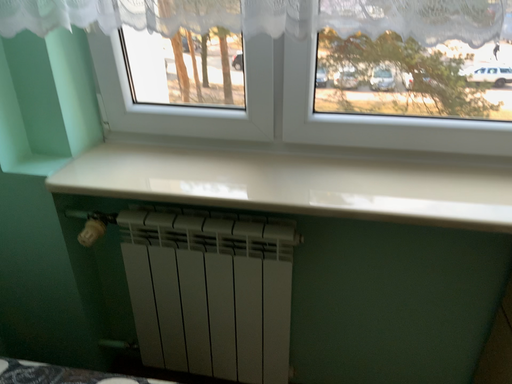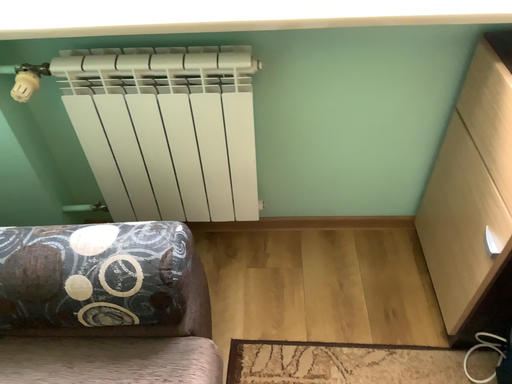
Question: How did the camera likely rotate when shooting the video?

Choices:
 (A) rotated right
 (B) rotated left

Answer: (A)